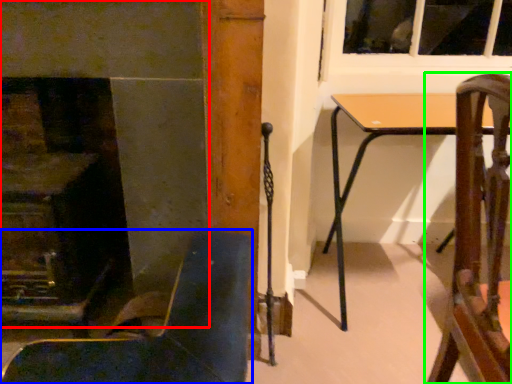
Question: Based on their relative distances, which object is nearer to fireplace (highlighted by a red box)? Choose from chair (highlighted by a blue box) and chair (highlighted by a green box).

Choices:
 (A) chair
 (B) chair

Answer: (A)